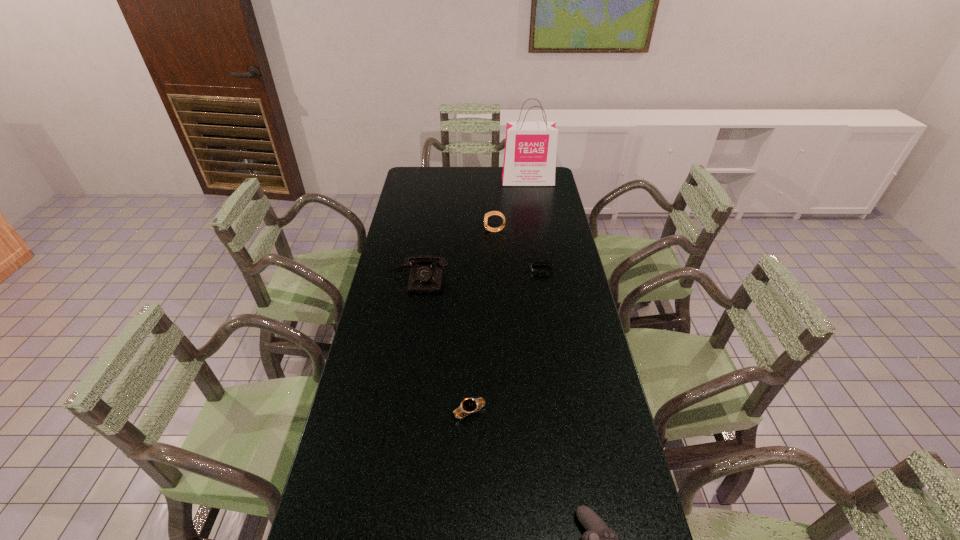
Identify the location of the farthest object. The height and width of the screenshot is (540, 960). (530, 147).

Find the location of a particular element. Image resolution: width=960 pixels, height=540 pixels. shopping bag is located at coordinates (530, 147).

You are a GUI agent. You are given a task and a screenshot of the screen. Output one action in this format:
    pyautogui.click(x=<x>, y=<y>)
    Task: Click on the leftmost object
    
    Given the screenshot: What is the action you would take?
    pyautogui.click(x=425, y=278)

The width and height of the screenshot is (960, 540). In order to click on the fourth object from right to left in this screenshot , I will do `click(491, 213)`.

Identify the location of the farther watch. Image resolution: width=960 pixels, height=540 pixels. (491, 213).

Locate an element on the screen. the shorter watch is located at coordinates (468, 406).

Where is `the left watch`? Image resolution: width=960 pixels, height=540 pixels. the left watch is located at coordinates (468, 406).

You are a GUI agent. You are given a task and a screenshot of the screen. Output one action in this format:
    pyautogui.click(x=<x>, y=<y>)
    Task: Click on the shortest object
    This screenshot has height=540, width=960.
    Given the screenshot: What is the action you would take?
    pyautogui.click(x=534, y=271)

The width and height of the screenshot is (960, 540). In order to click on free space located on the front-facing side of the farthest object in this screenshot , I will do [531, 199].

The width and height of the screenshot is (960, 540). What are the coordinates of `vacant area situated on the front face of the telephone` in the screenshot? It's located at (411, 326).